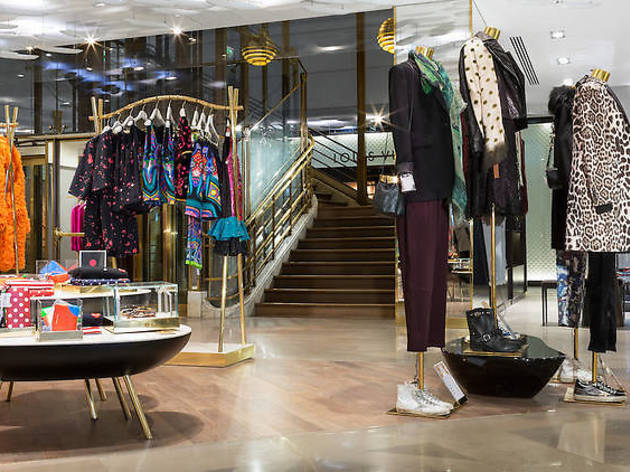
The width and height of the screenshot is (630, 472). Find the location of `tile flooring`. tile flooring is located at coordinates pos(323,454), pos(322,411), pos(324,339).